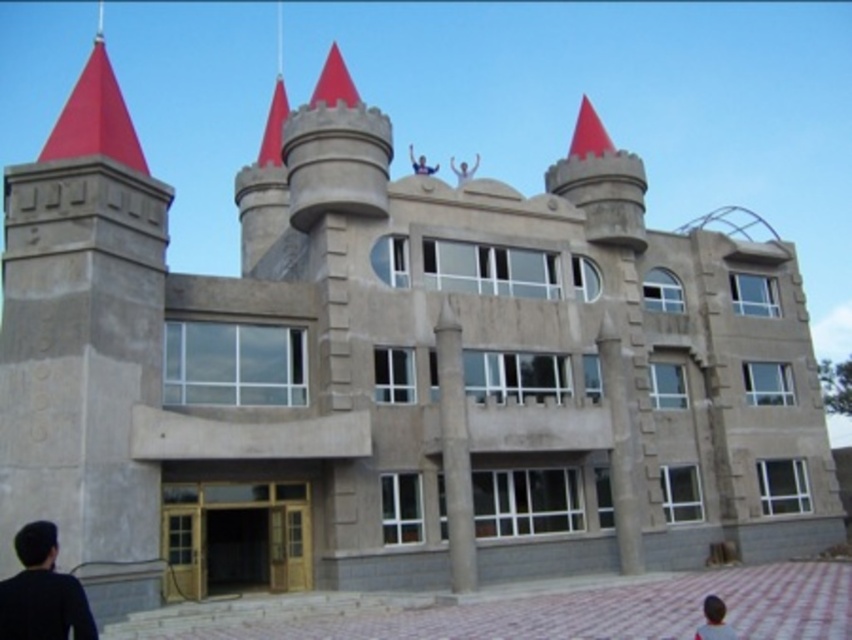
Question: Based on their relative distances, which object is nearer to the smooth skin person at upper center?

Choices:
 (A) white matte head at lower right
 (B) white matte person at upper center

Answer: (B)

Question: Does black matte shirt at lower left appear on the left side of white matte person at upper center?

Choices:
 (A) no
 (B) yes

Answer: (B)

Question: Can you confirm if white matte head at lower right is positioned to the left of white matte person at upper center?

Choices:
 (A) yes
 (B) no

Answer: (B)

Question: Which point is closer to the camera?

Choices:
 (A) black matte shirt at lower left
 (B) smooth skin person at upper center
 (C) white matte head at lower right

Answer: (A)

Question: Does white matte head at lower right appear over smooth skin person at upper center?

Choices:
 (A) yes
 (B) no

Answer: (B)

Question: Based on their relative distances, which object is farther from the smooth skin person at upper center?

Choices:
 (A) white matte person at upper center
 (B) white matte head at lower right

Answer: (B)